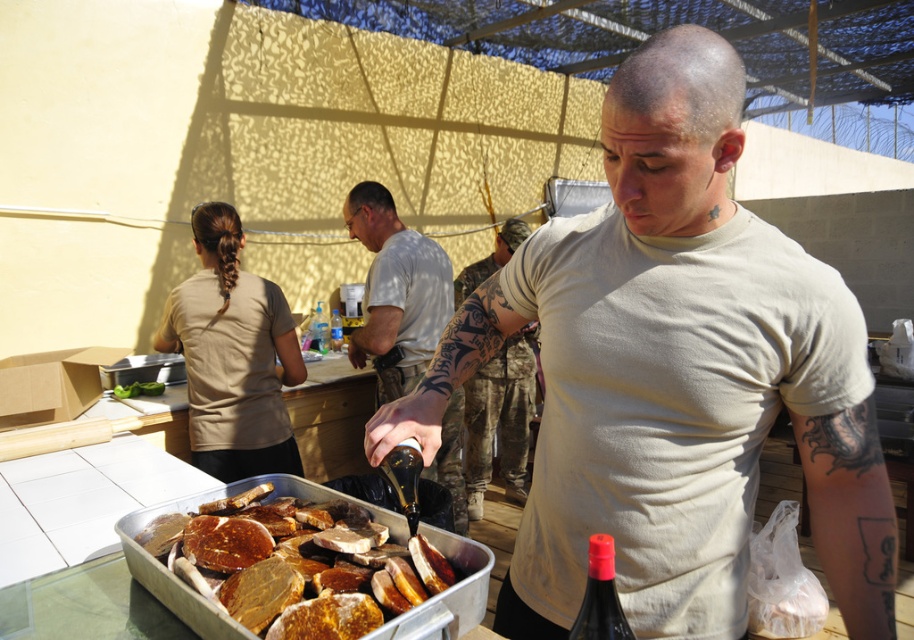
You are standing in the outdoor area under the mesh roof and want to reach the point marked as point (532, 394). If your arm can extend 1.5 meters, can you reach it without moving your feet?

The point (532, 394) is 3.59 meters away from the viewer. Since your arm can only extend 1.5 meters, you cannot reach it without moving your feet.